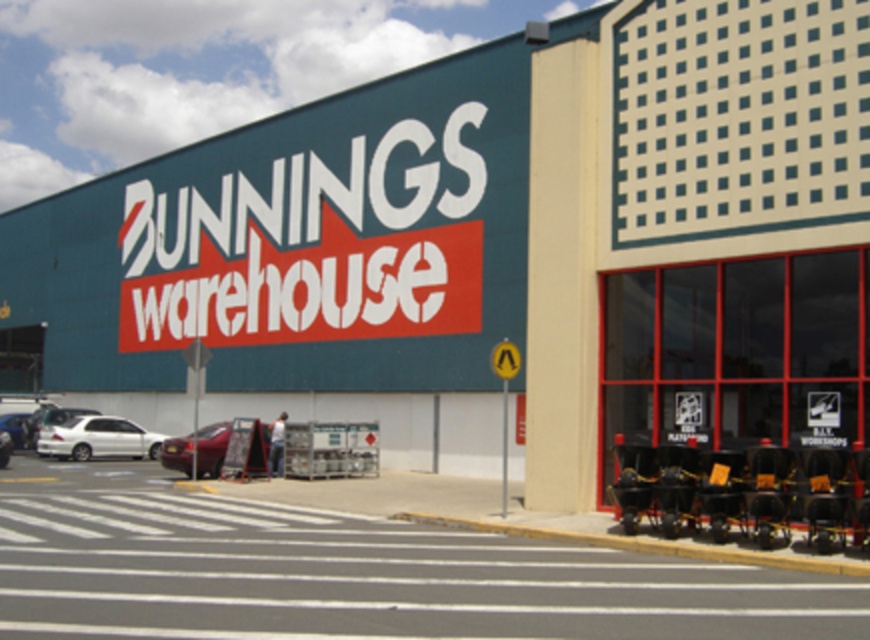
You are standing in front of the Bunnings Warehouse store and want to take a photo. You notice two points on the building facade. The first point is at coordinate point [175,451] and the second is at point [19,413]. Which point will appear larger in your photo?

Point [175,451] will appear larger in the photo because it is closer to the camera than point [19,413].

You are standing at the entrance of the Bunnings Warehouse store. You need to park your car in the closest available parking spot. The parking spots are arranged in a grid pattern starting from the entrance. Your car is exactly at the position of the white matte sedan at lower left. Which direction should you drive to reach the nearest parking spot?

Since the white matte sedan at lower left is already positioned at point (97, 438), which is likely the nearest parking spot, you do not need to drive further in any direction. You are already at the designated parking spot.